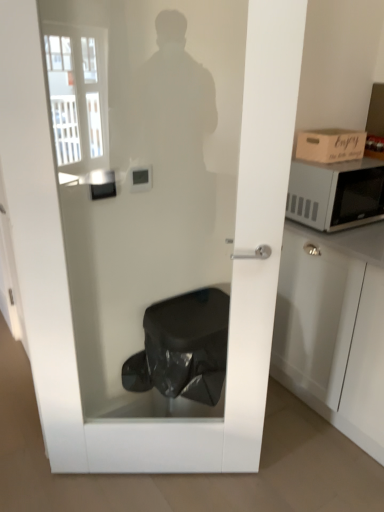
Question: Considering the relative positions of wooden cardboard box at upper right and satin silver microwave at right in the image provided, is wooden cardboard box at upper right to the right of satin silver microwave at right from the viewer's perspective?

Choices:
 (A) no
 (B) yes

Answer: (A)

Question: Are wooden cardboard box at upper right and satin silver microwave at right located far from each other?

Choices:
 (A) yes
 (B) no

Answer: (B)

Question: Considering the relative sizes of wooden cardboard box at upper right and satin silver microwave at right in the image provided, is wooden cardboard box at upper right bigger than satin silver microwave at right?

Choices:
 (A) yes
 (B) no

Answer: (B)

Question: Is wooden cardboard box at upper right taller than satin silver microwave at right?

Choices:
 (A) no
 (B) yes

Answer: (A)

Question: Is the position of wooden cardboard box at upper right less distant than that of satin silver microwave at right?

Choices:
 (A) yes
 (B) no

Answer: (B)

Question: Can you confirm if wooden cardboard box at upper right is thinner than satin silver microwave at right?

Choices:
 (A) yes
 (B) no

Answer: (A)

Question: Is satin silver microwave at right behind wooden cardboard box at upper right?

Choices:
 (A) no
 (B) yes

Answer: (A)

Question: Does satin silver microwave at right have a lesser height compared to wooden cardboard box at upper right?

Choices:
 (A) no
 (B) yes

Answer: (A)

Question: Is the depth of satin silver microwave at right less than that of wooden cardboard box at upper right?

Choices:
 (A) yes
 (B) no

Answer: (A)

Question: From a real-world perspective, is satin silver microwave at right positioned over wooden cardboard box at upper right based on gravity?

Choices:
 (A) no
 (B) yes

Answer: (A)

Question: From the image's perspective, does satin silver microwave at right appear lower than wooden cardboard box at upper right?

Choices:
 (A) yes
 (B) no

Answer: (A)

Question: Is satin silver microwave at right positioned far away from wooden cardboard box at upper right?

Choices:
 (A) no
 (B) yes

Answer: (A)

Question: Is satin silver microwave at right inside or outside of wooden cardboard box at upper right?

Choices:
 (A) outside
 (B) inside

Answer: (A)